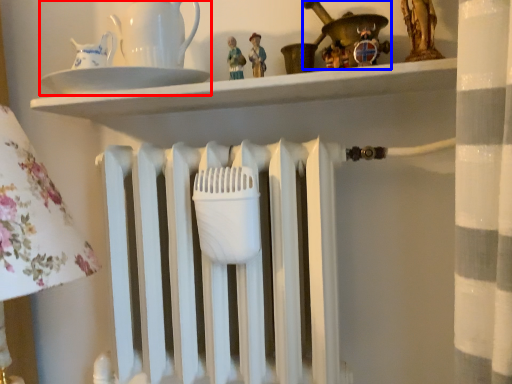
Question: Which point is closer to the camera, tea set (highlighted by a red box) or toy (highlighted by a blue box)?

Choices:
 (A) tea set
 (B) toy

Answer: (B)